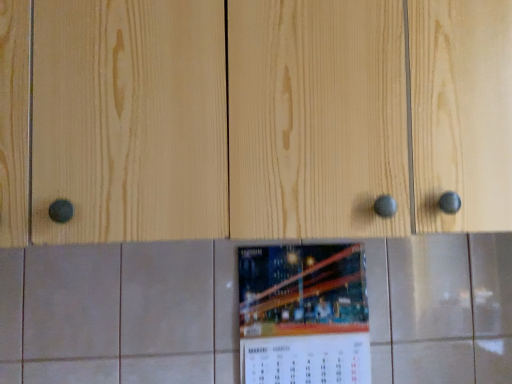
What is the approximate height of metallic calendar at center?

metallic calendar at center is 12.84 inches tall.

At what (x,y) coordinates should I click in order to perform the action: click on metallic calendar at center. Please return your answer as a coordinate pair (x, y). The image size is (512, 384). Looking at the image, I should click on (303, 314).

What do you see at coordinates (303, 314) in the screenshot? The image size is (512, 384). I see `metallic calendar at center` at bounding box center [303, 314].

Where is `metallic calendar at center`? metallic calendar at center is located at coordinates (303, 314).